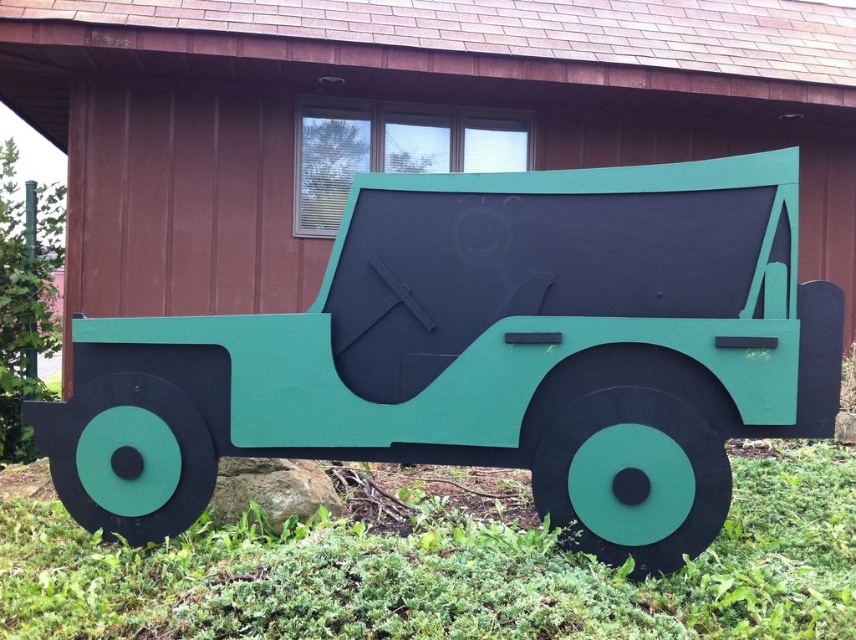
You are standing at the entrance of the wooden building and want to place a new decorative flagpole exactly at the center of the matte green jeep at center. What are the coordinates where you should place the flagpole?

The coordinates for the center of the matte green jeep at center are 0.555 in the x direction and 0.569 in the y direction, so you should place the flagpole at those coordinates.

You are standing in front of the vintage military jeep cutout. There are two points marked on the jeep. One is at coordinate point [217,150] and the other at point [413,493]. If you want to touch the point closer to you, which coordinate should you aim for?

Point [217,150] is further to the camera than point [413,493], so the closer point to you is point [217,150]. You should aim for point [217,150].